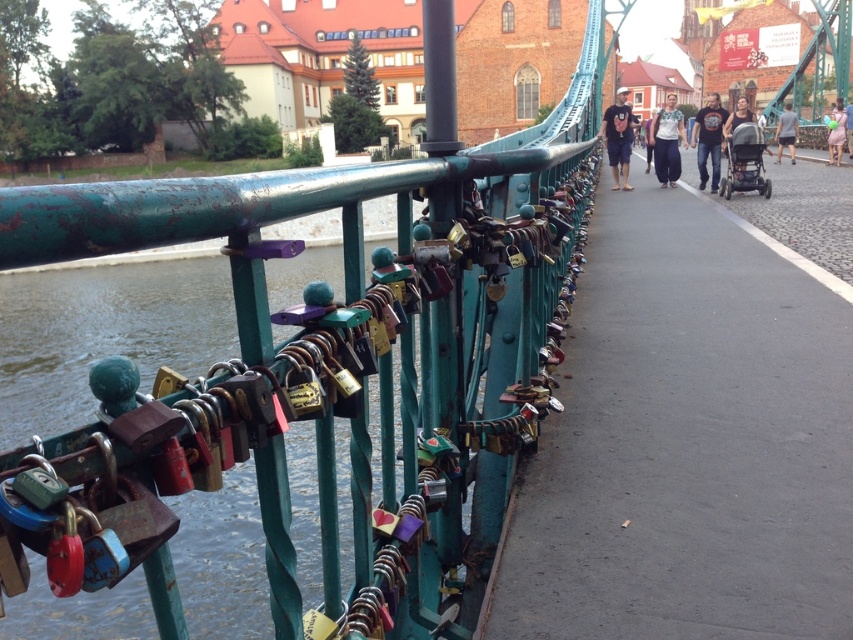
Is matte black backpack at center positioned at the back of dark blue jeans at center?

No, it is in front of dark blue jeans at center.

Between matte black backpack at center and dark blue jeans at center, which one has more height?

With more height is dark blue jeans at center.

Does point (636, 122) come in front of point (790, 138)?

Yes, it is in front of point (790, 138).

Where is `matte black backpack at center`? The height and width of the screenshot is (640, 853). matte black backpack at center is located at coordinates tap(618, 136).

Is point (364, 403) closer to camera compared to point (624, 122)?

Yes, point (364, 403) is closer to viewer.

Who is taller, green metal rail at upper left or matte black backpack at center?

Standing taller between the two is green metal rail at upper left.

Who is more forward, (97, 493) or (625, 170)?

Point (97, 493) is more forward.

The width and height of the screenshot is (853, 640). I want to click on green metal rail at upper left, so click(x=320, y=362).

This screenshot has width=853, height=640. What are the coordinates of `metallic padlocks at center` in the screenshot? It's located at (689, 440).

Is metallic padlocks at center below light pink fabric dress at right?

Correct, metallic padlocks at center is located below light pink fabric dress at right.

Describe the element at coordinates (689, 440) in the screenshot. The width and height of the screenshot is (853, 640). I see `metallic padlocks at center` at that location.

Where is `metallic padlocks at center`? metallic padlocks at center is located at coordinates (689, 440).